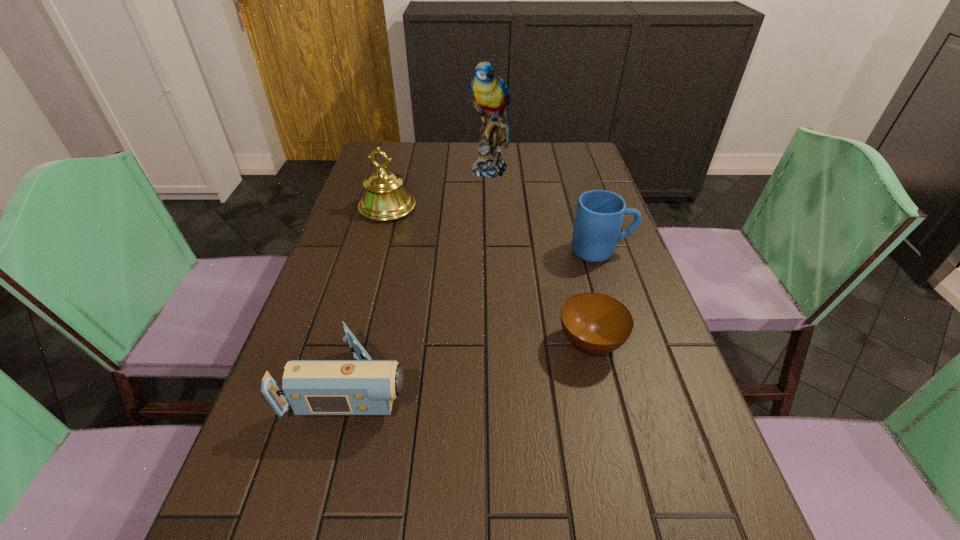
At what (x,y) coordinates should I click in order to perform the action: click on free spot located on the side of the fourth tallest object with the flip-out screen. Please return your answer as a coordinate pair (x, y). This screenshot has height=540, width=960. Looking at the image, I should click on (449, 383).

This screenshot has height=540, width=960. In order to click on vacant region located 0.110m on the left of the shortest object in this screenshot , I will do `click(504, 343)`.

Locate an element on the screen. This screenshot has width=960, height=540. object positioned at the far edge is located at coordinates (491, 94).

This screenshot has height=540, width=960. What are the coordinates of `bell that is at the left edge` in the screenshot? It's located at (385, 198).

Where is `camcorder that is at the left edge`? The height and width of the screenshot is (540, 960). camcorder that is at the left edge is located at coordinates (364, 387).

Where is `mug situated at the right edge`? mug situated at the right edge is located at coordinates (599, 216).

In order to click on bowl that is positioned at the right edge in this screenshot , I will do `click(594, 323)`.

The height and width of the screenshot is (540, 960). Find the location of `free space at the far edge of the desktop`. free space at the far edge of the desktop is located at coordinates (537, 147).

Image resolution: width=960 pixels, height=540 pixels. What are the coordinates of `free space at the left edge of the desktop` in the screenshot? It's located at (238, 539).

Where is `free spot at the right edge of the desktop`? The width and height of the screenshot is (960, 540). free spot at the right edge of the desktop is located at coordinates (560, 180).